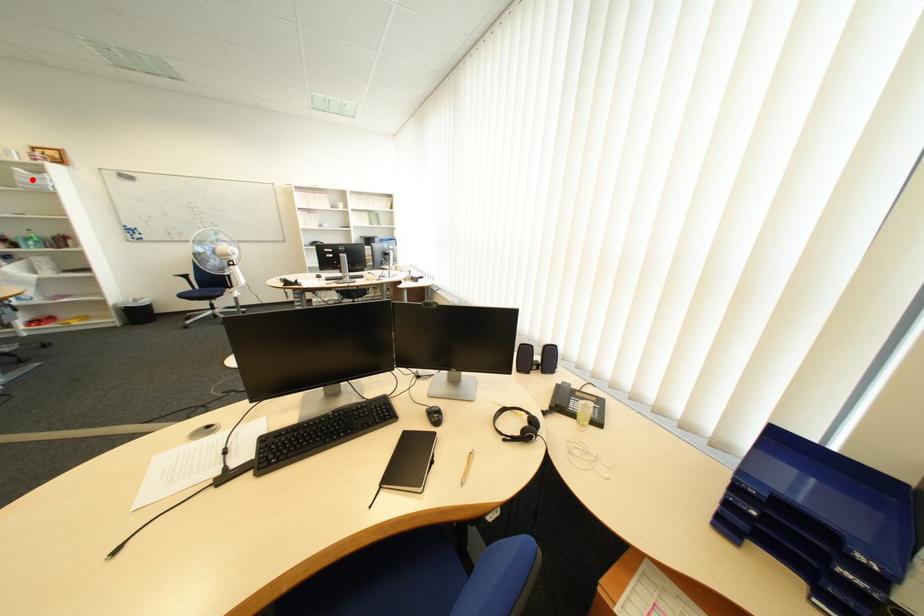
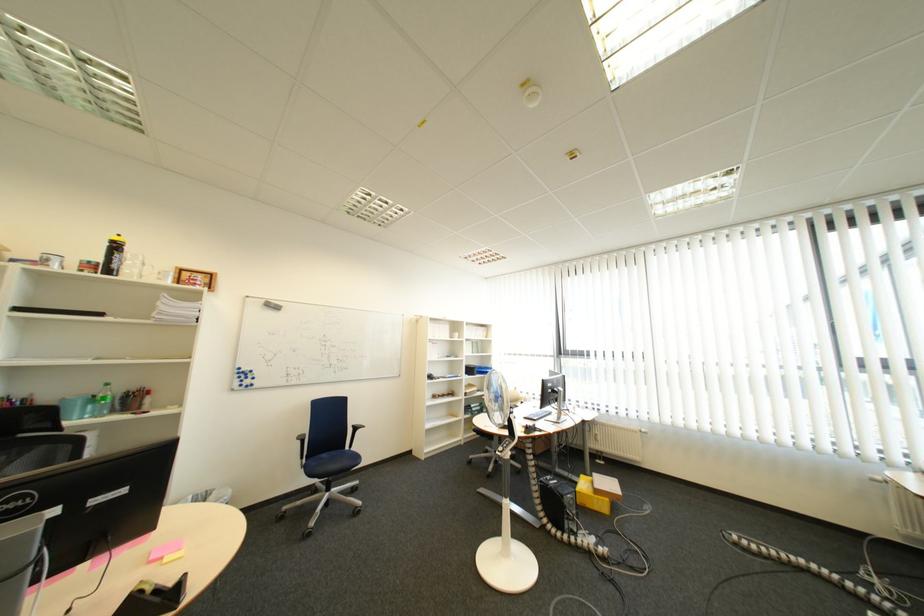
Find the pixel in the second image that matches the highlighted location in the first image.

(175, 309)